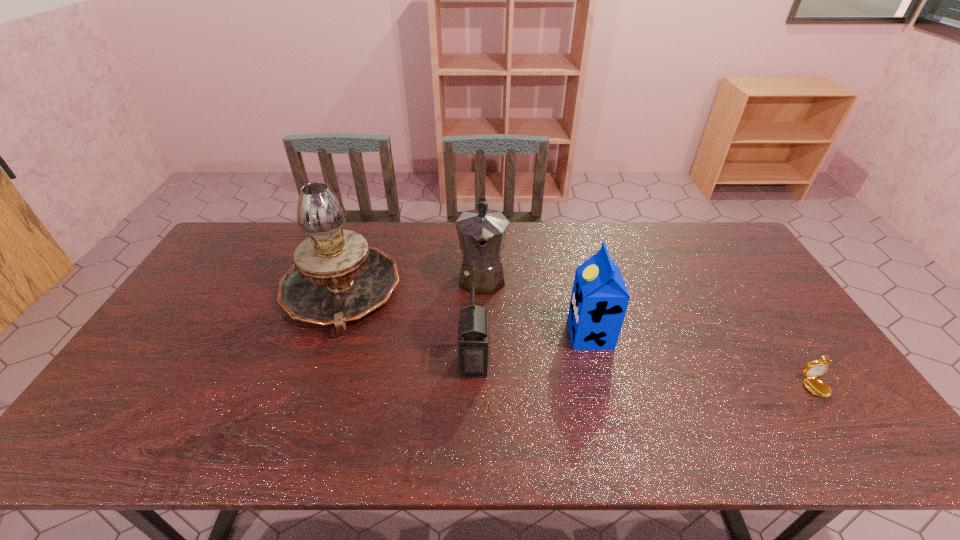
The height and width of the screenshot is (540, 960). I want to click on free space between the coffeepot and the carton, so click(x=536, y=305).

Image resolution: width=960 pixels, height=540 pixels. Find the location of `free spot between the second shortest object and the pocket watch`. free spot between the second shortest object and the pocket watch is located at coordinates (648, 374).

I want to click on object that is the fourth closest to the carton, so click(x=335, y=277).

Identify the location of object that is the second closest to the coffeepot. (335, 277).

Locate an element on the screen. The image size is (960, 540). free spot that satisfies the following two spatial constraints: 1. on the pouring side of the coffeepot; 2. on the front-facing side of the lantern is located at coordinates (483, 363).